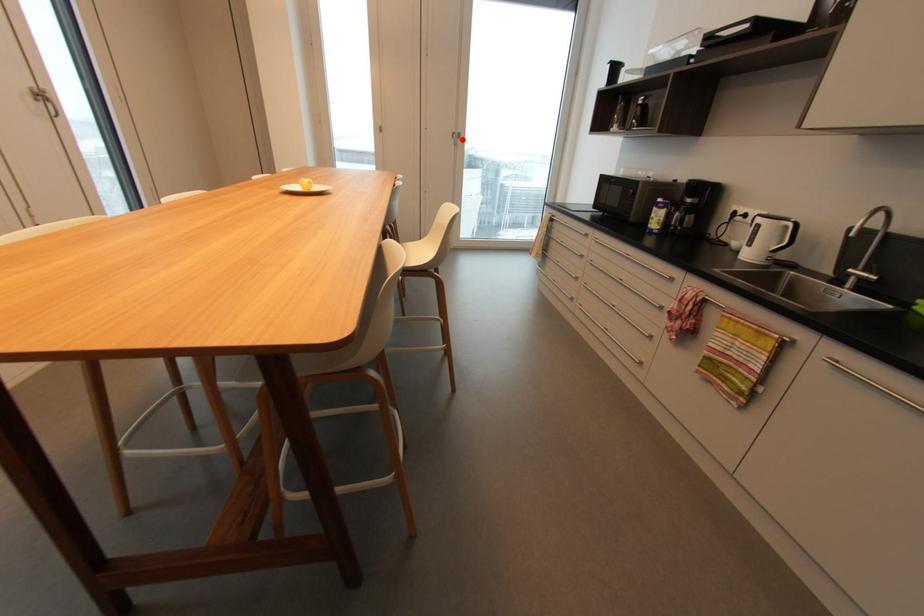
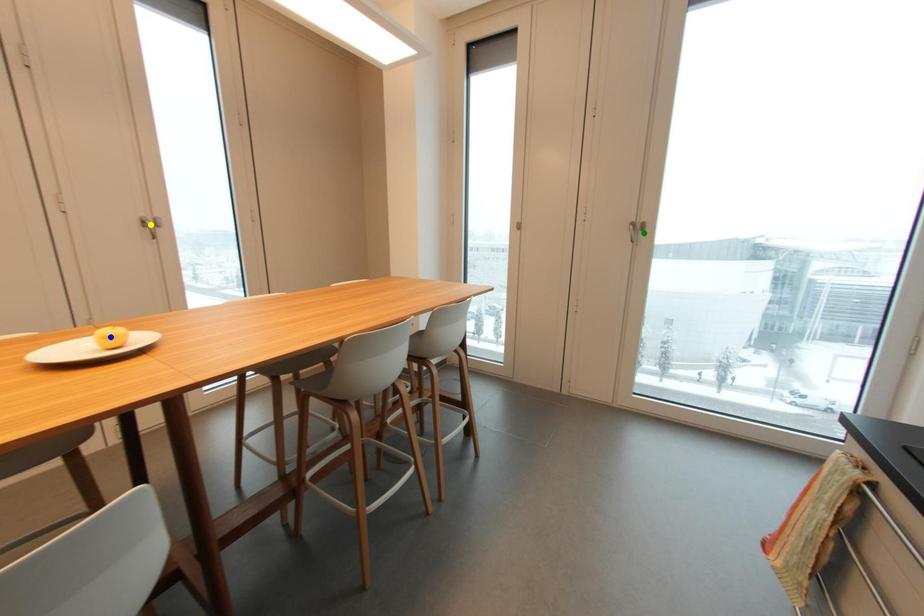
Question: I am providing you with two images of the same scene from different viewpoints. A red point is marked on the first image. You are given multiple points on the second image. Which point in image 2 represents the same 3d spot as the red point in image 1?

Choices:
 (A) blue point
 (B) green point
 (C) yellow point

Answer: (B)